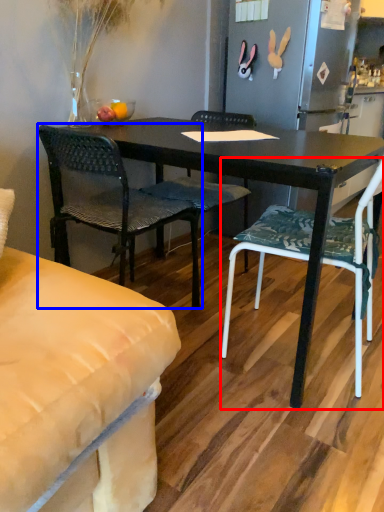
Question: Which object is further to the camera taking this photo, chair (highlighted by a red box) or chair (highlighted by a blue box)?

Choices:
 (A) chair
 (B) chair

Answer: (B)